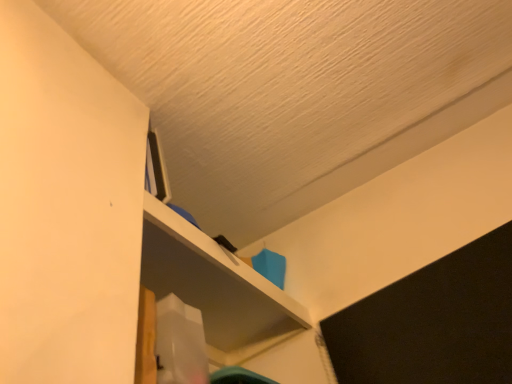
Measure the distance between white matte shelf at upper center and camera.

white matte shelf at upper center and camera are 34.99 inches apart.

What do you see at coordinates (216, 288) in the screenshot?
I see `white matte shelf at upper center` at bounding box center [216, 288].

The width and height of the screenshot is (512, 384). I want to click on white matte shelf at upper center, so click(216, 288).

At what (x,y) coordinates should I click in order to perform the action: click on white matte shelf at upper center. Please return your answer as a coordinate pair (x, y). Looking at the image, I should click on (216, 288).